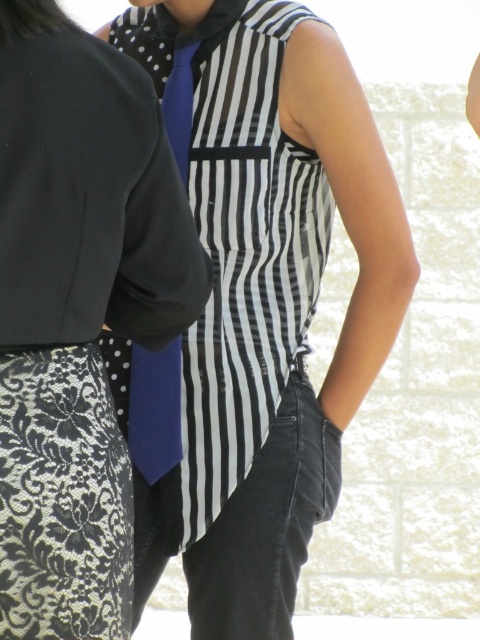
Is matte striped shirt at center wider than blue satin tie at center?

Yes.

The image size is (480, 640). Identify the location of matte striped shirt at center. (264, 300).

In order to click on matte striped shirt at center in this screenshot , I will do `click(264, 300)`.

Does black lace skirt at lower left appear over blue satin tie at center?

Yes, black lace skirt at lower left is above blue satin tie at center.

Can you confirm if black lace skirt at lower left is taller than blue satin tie at center?

Indeed, black lace skirt at lower left has a greater height compared to blue satin tie at center.

Identify the location of black lace skirt at lower left. (76, 312).

Which is more to the left, matte striped shirt at center or black lace skirt at lower left?

From the viewer's perspective, black lace skirt at lower left appears more on the left side.

In the scene shown: Can you confirm if matte striped shirt at center is thinner than black lace skirt at lower left?

No, matte striped shirt at center is not thinner than black lace skirt at lower left.

Measure the distance between matte striped shirt at center and camera.

matte striped shirt at center is 2.53 meters from camera.

Identify the location of matte striped shirt at center. This screenshot has height=640, width=480. (264, 300).